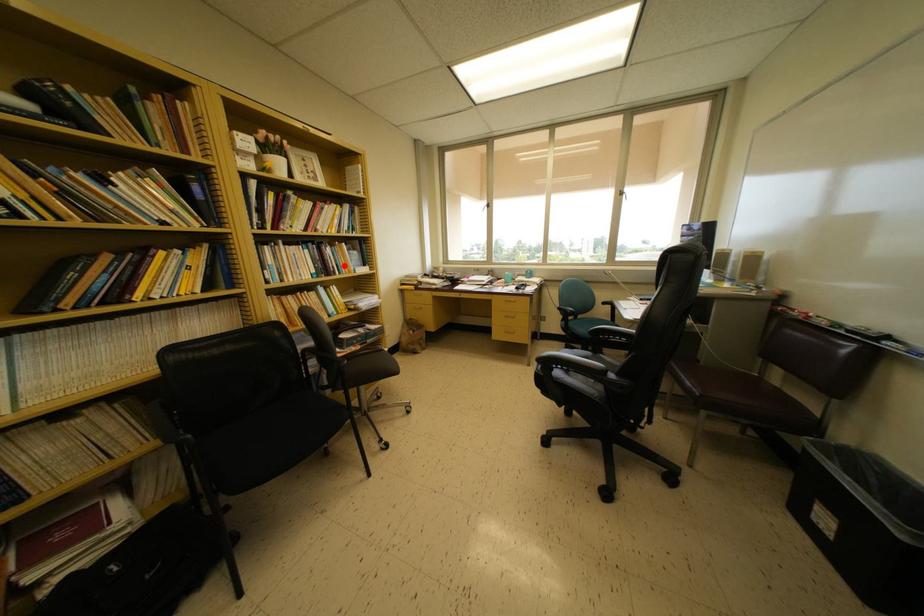
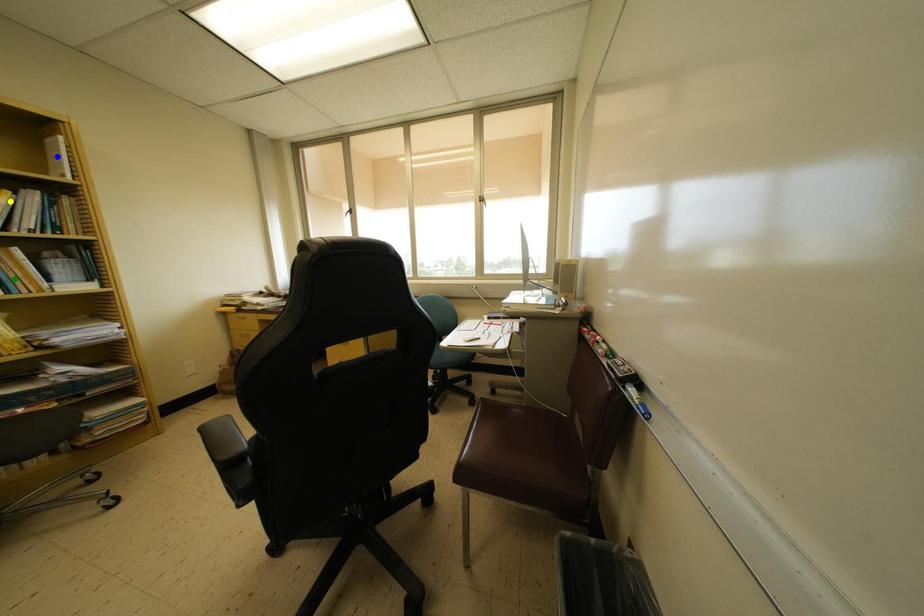
Question: I am providing you with two images of the same scene from different viewpoints. A red point is marked on the first image. You are given multiple points on the second image. Which point in image 2 represents the same 3d spot as the red point in image 1?

Choices:
 (A) blue point
 (B) green point
 (C) yellow point

Answer: (B)